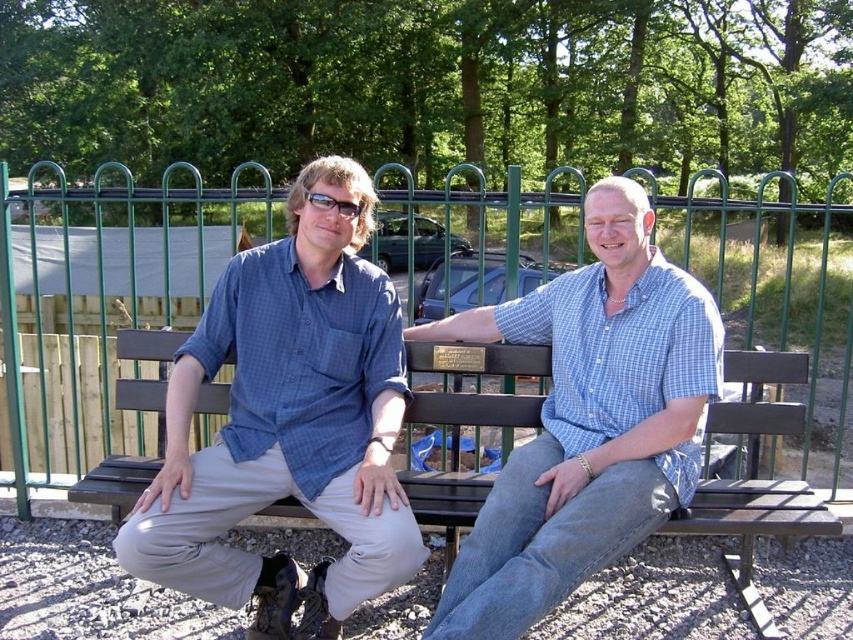
Can you confirm if matte blue shirt at left is positioned below brown wooden bench at center?

No.

At what (x,y) coordinates should I click in order to perform the action: click on matte blue shirt at left. Please return your answer as a coordinate pair (x, y). Looking at the image, I should click on (288, 424).

Does matte blue shirt at left appear on the right side of green metal fence at upper center?

In fact, matte blue shirt at left is to the left of green metal fence at upper center.

Consider the image. Is matte blue shirt at left positioned behind green metal fence at upper center?

No, it is in front of green metal fence at upper center.

The image size is (853, 640). What do you see at coordinates (288, 424) in the screenshot?
I see `matte blue shirt at left` at bounding box center [288, 424].

Where is `matte blue shirt at left`? matte blue shirt at left is located at coordinates (288, 424).

Can you confirm if green metal fence at upper center is taller than brown wooden bench at center?

Yes.

This screenshot has height=640, width=853. What do you see at coordinates (74, 364) in the screenshot? I see `green metal fence at upper center` at bounding box center [74, 364].

Who is more distant from viewer, (503,394) or (68,497)?

Positioned behind is point (503,394).

I want to click on green metal fence at upper center, so click(74, 364).